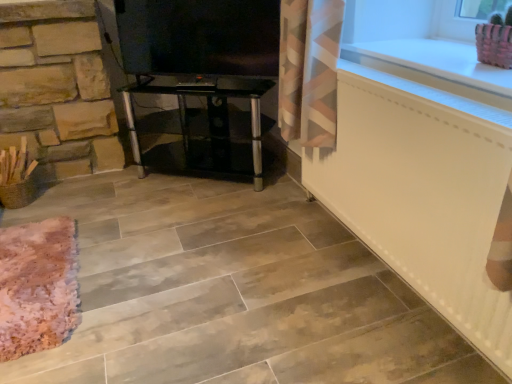
Question: From the image's perspective, relative to white glossy counter top at upper right, is white matte radiator at lower right above or below?

Choices:
 (A) below
 (B) above

Answer: (A)

Question: Would you say white matte radiator at lower right is to the left or to the right of white glossy counter top at upper right in the picture?

Choices:
 (A) left
 (B) right

Answer: (A)

Question: Which object is positioned closest to the white glossy counter top at upper right?

Choices:
 (A) black glass tv stand at center
 (B) white matte radiator at lower right
 (C) pink fabric basket at upper right

Answer: (B)

Question: Which object is positioned closest to the white matte radiator at lower right?

Choices:
 (A) pink fabric basket at upper right
 (B) black glass tv stand at center
 (C) white glossy counter top at upper right

Answer: (C)